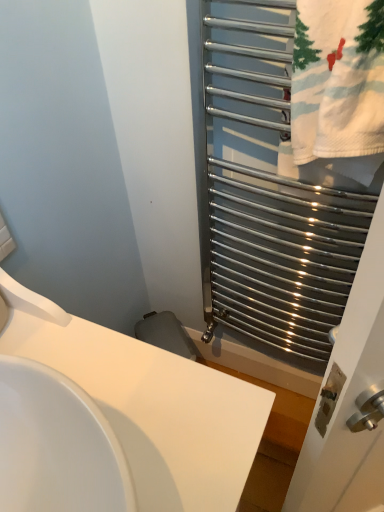
Question: Can you confirm if polished metal towel rack at right is wider than white glossy sink at center?

Choices:
 (A) yes
 (B) no

Answer: (B)

Question: From the image's perspective, is polished metal towel rack at right beneath white glossy sink at center?

Choices:
 (A) no
 (B) yes

Answer: (A)

Question: Is polished metal towel rack at right oriented away from white glossy sink at center?

Choices:
 (A) no
 (B) yes

Answer: (A)

Question: Is white glossy sink at center a part of polished metal towel rack at right?

Choices:
 (A) no
 (B) yes

Answer: (A)

Question: Does polished metal towel rack at right touch white glossy sink at center?

Choices:
 (A) yes
 (B) no

Answer: (B)

Question: From a real-world perspective, is white cotton towel at right physically located above or below white glossy sink at center?

Choices:
 (A) above
 (B) below

Answer: (A)

Question: In terms of size, does white cotton towel at right appear bigger or smaller than white glossy sink at center?

Choices:
 (A) small
 (B) big

Answer: (A)

Question: In the image, is white cotton towel at right on the left side or the right side of white glossy sink at center?

Choices:
 (A) left
 (B) right

Answer: (B)

Question: Considering the positions of white cotton towel at right and white glossy sink at center in the image, is white cotton towel at right wider or thinner than white glossy sink at center?

Choices:
 (A) thin
 (B) wide

Answer: (A)

Question: Looking at the image, does white cotton towel at right seem bigger or smaller compared to polished metal towel rack at right?

Choices:
 (A) small
 (B) big

Answer: (A)

Question: Is white cotton towel at right situated inside polished metal towel rack at right or outside?

Choices:
 (A) inside
 (B) outside

Answer: (A)

Question: From the image's perspective, is white cotton towel at right positioned above or below polished metal towel rack at right?

Choices:
 (A) below
 (B) above

Answer: (B)

Question: Would you say white cotton towel at right is to the left or to the right of polished metal towel rack at right in the picture?

Choices:
 (A) left
 (B) right

Answer: (B)

Question: Does point (206, 455) appear closer or farther from the camera than point (311, 169)?

Choices:
 (A) farther
 (B) closer

Answer: (B)

Question: Considering the positions of white glossy sink at center and white cotton towel at right in the image, is white glossy sink at center wider or thinner than white cotton towel at right?

Choices:
 (A) wide
 (B) thin

Answer: (A)